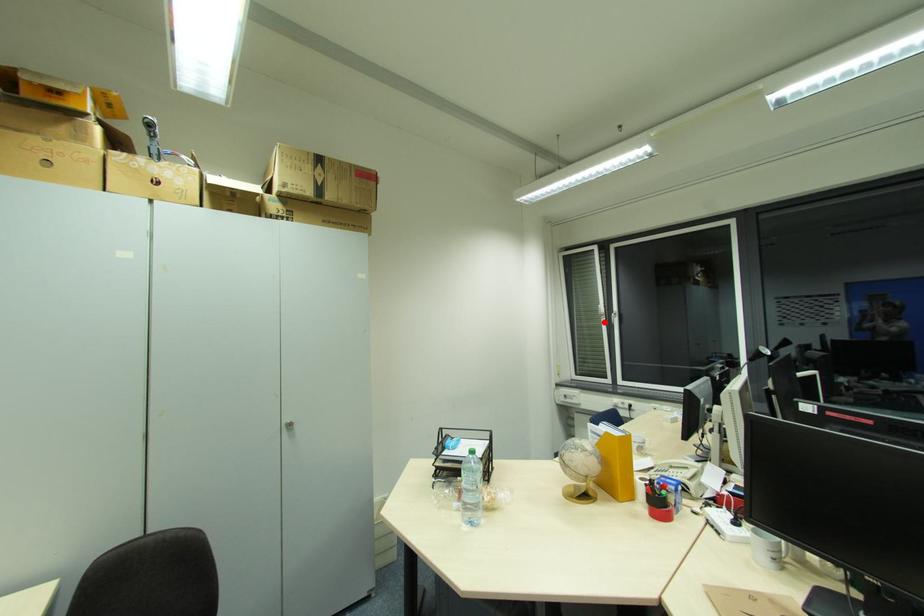
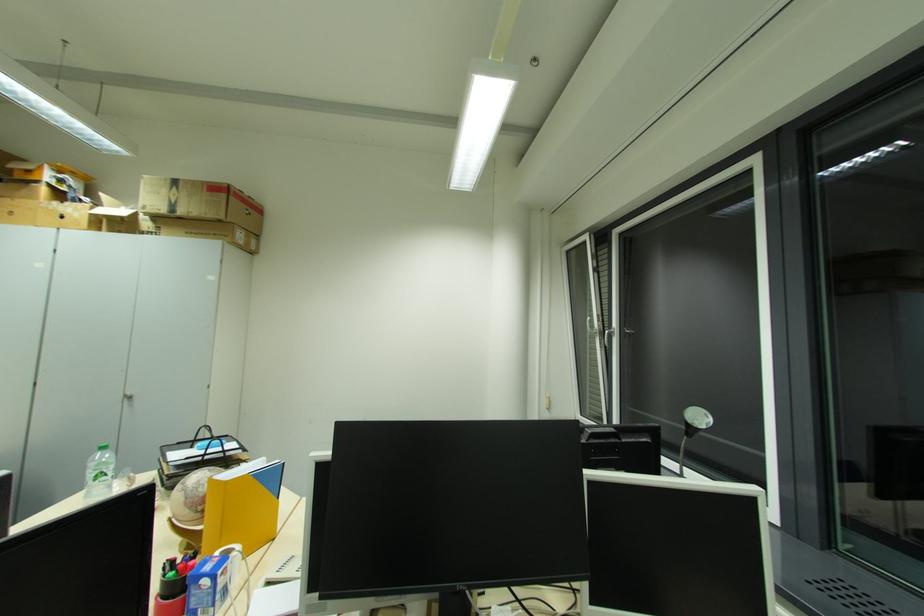
In the second image, find the point that corresponds to the highlighted location in the first image.

(600, 342)